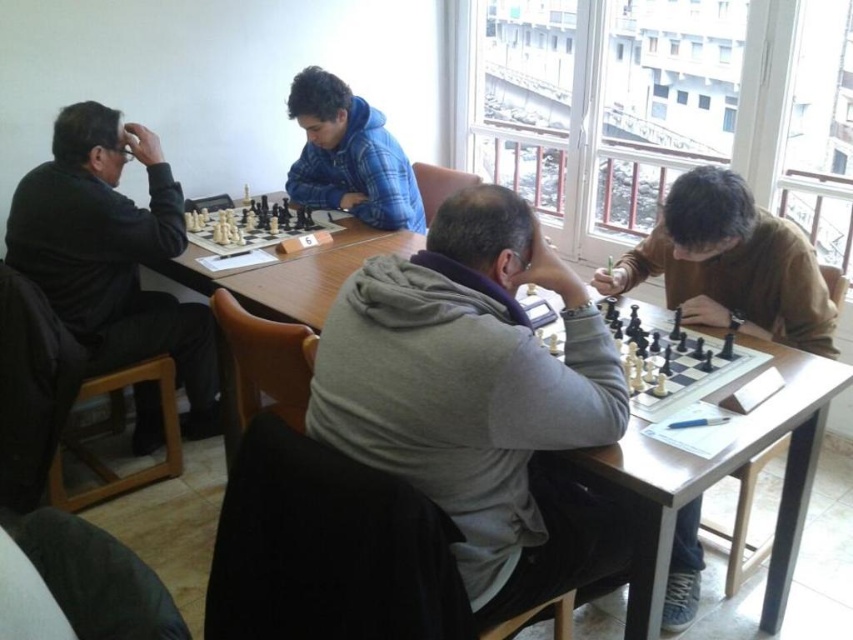
You are a photographer taking a picture of the blue plaid hoodie at center and the black plastic chess set at center. Which object should you focus on first if you want to ensure both are in focus, considering their heights?

The blue plaid hoodie at center is much taller than the black plastic chess set at center, so you should focus on the blue plaid hoodie at center first to ensure both are in focus.